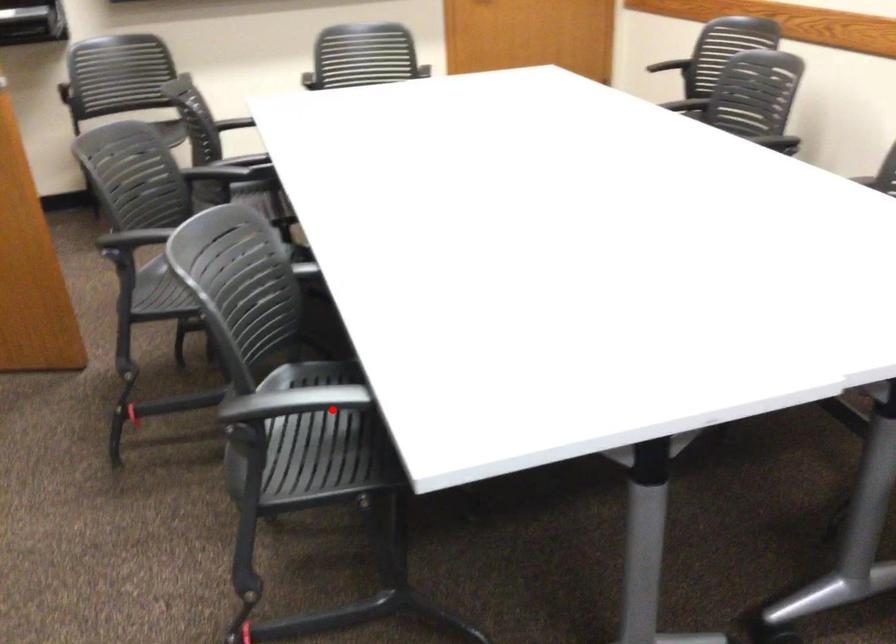
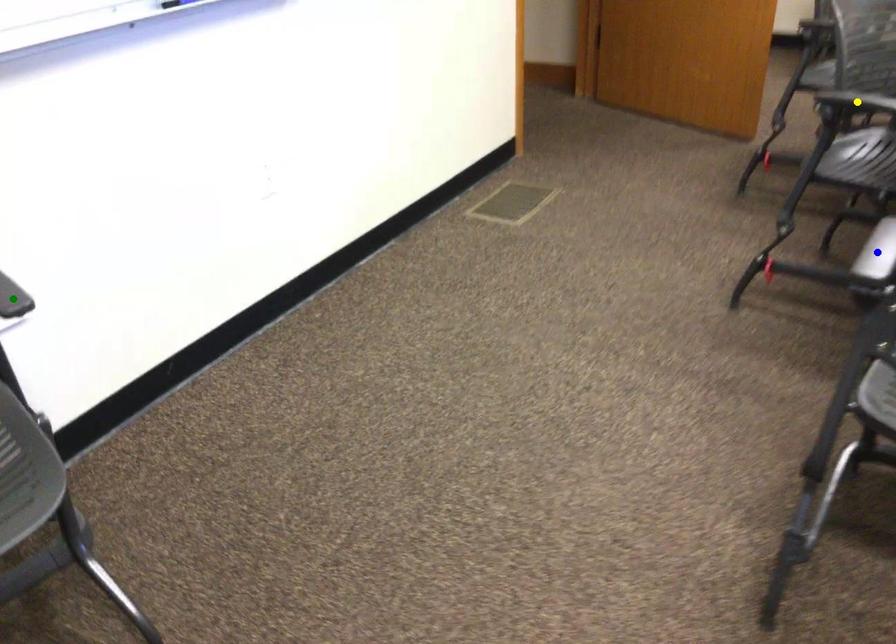
Question: I am providing you with two images of the same scene from different viewpoints. A red point is marked on the first image. You are given multiple points on the second image. Which point in image 2 is actually the same real-world point as the red point in image 1?

Choices:
 (A) green point
 (B) yellow point
 (C) blue point

Answer: (B)